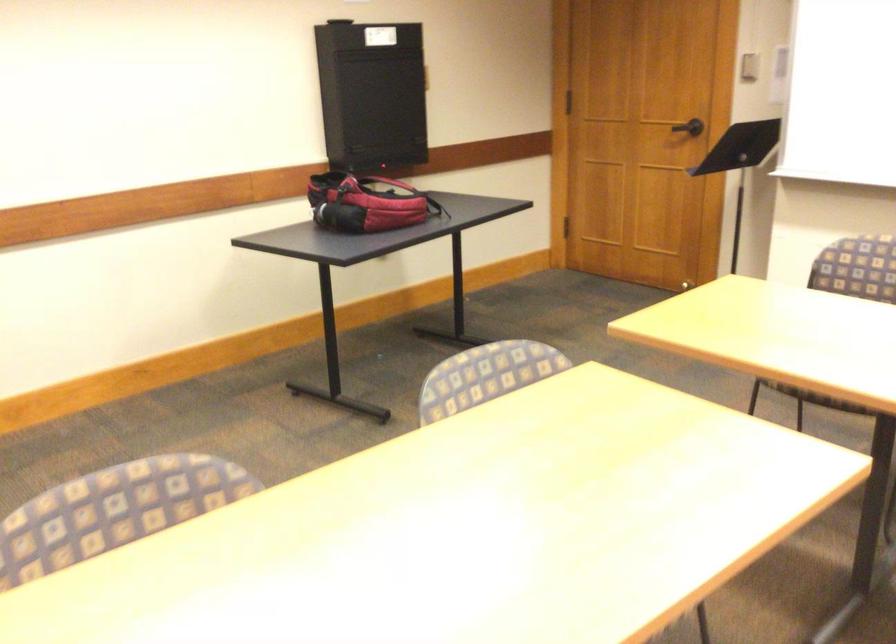
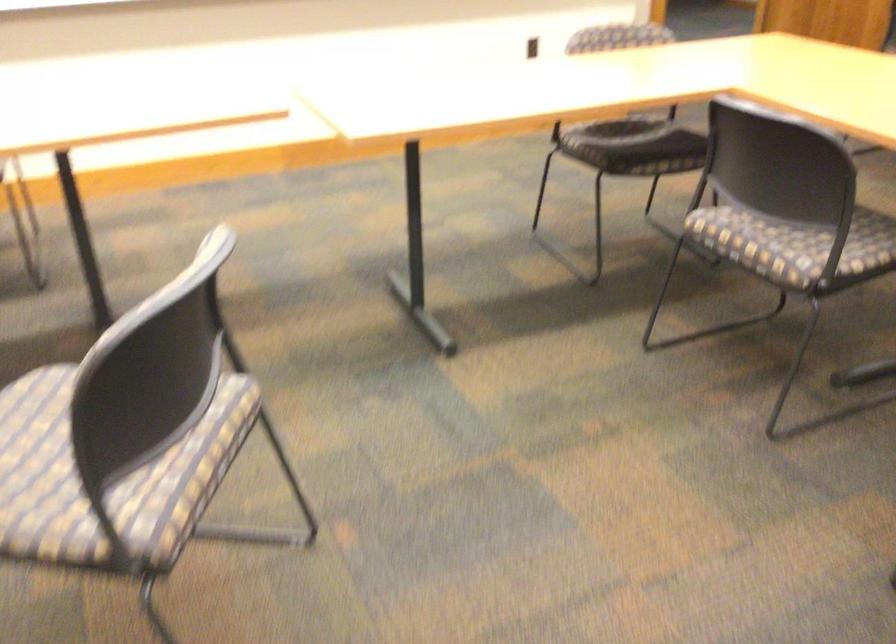
Based on the continuous images, in which direction is the camera rotating?

The camera's rotation is toward right-down.